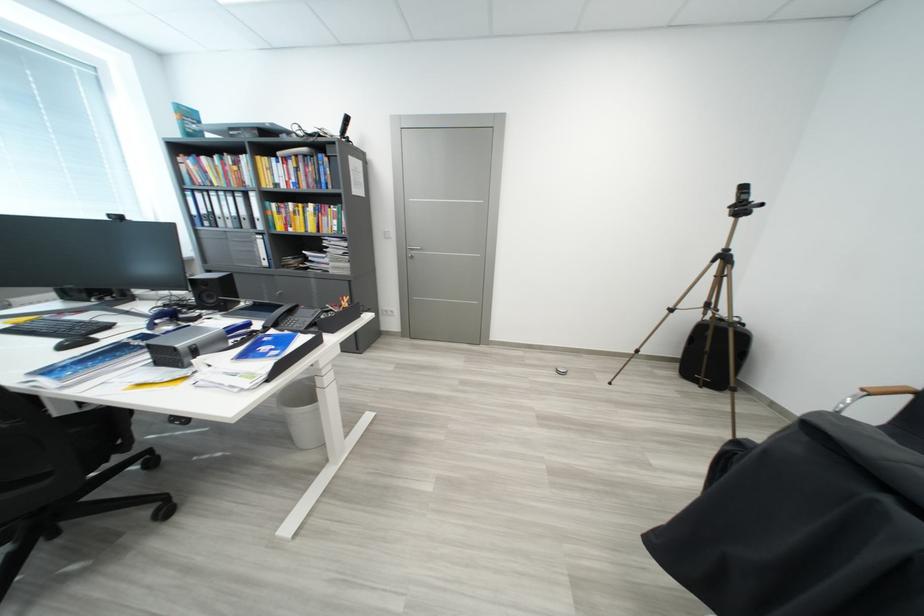
Where would you lift the black computer mouse? Please return your answer as a coordinate pair (x, y).

(74, 342)